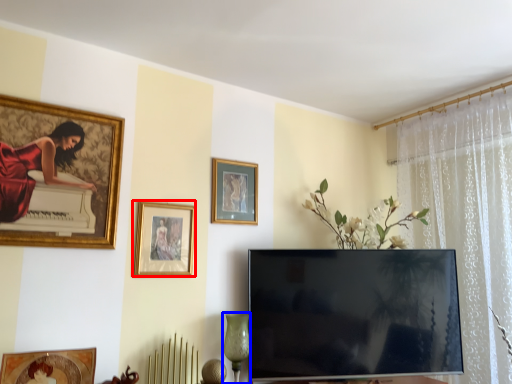
Question: Which of the following is the closest to the observer, picture frame (highlighted by a red box) or glass vase (highlighted by a blue box)?

Choices:
 (A) picture frame
 (B) glass vase

Answer: (B)